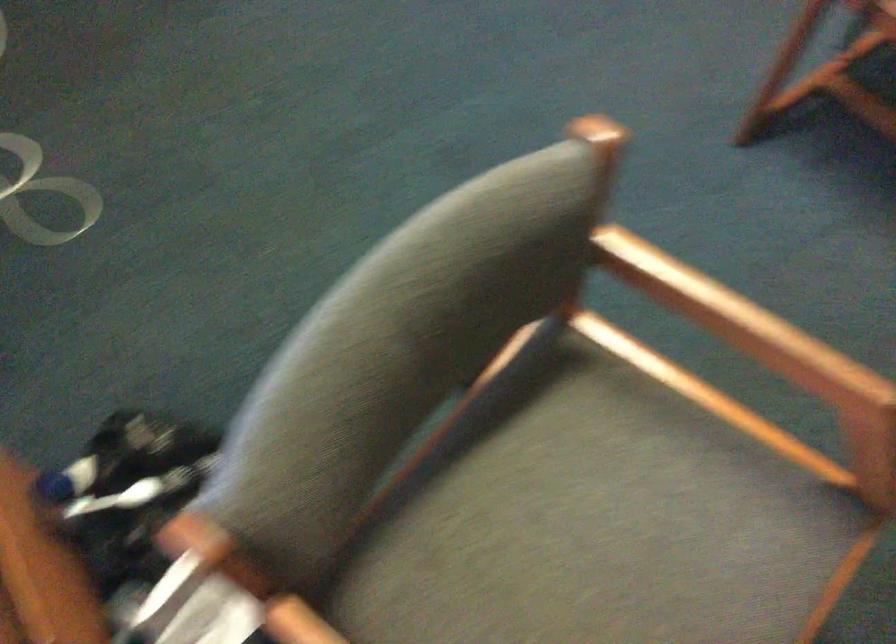
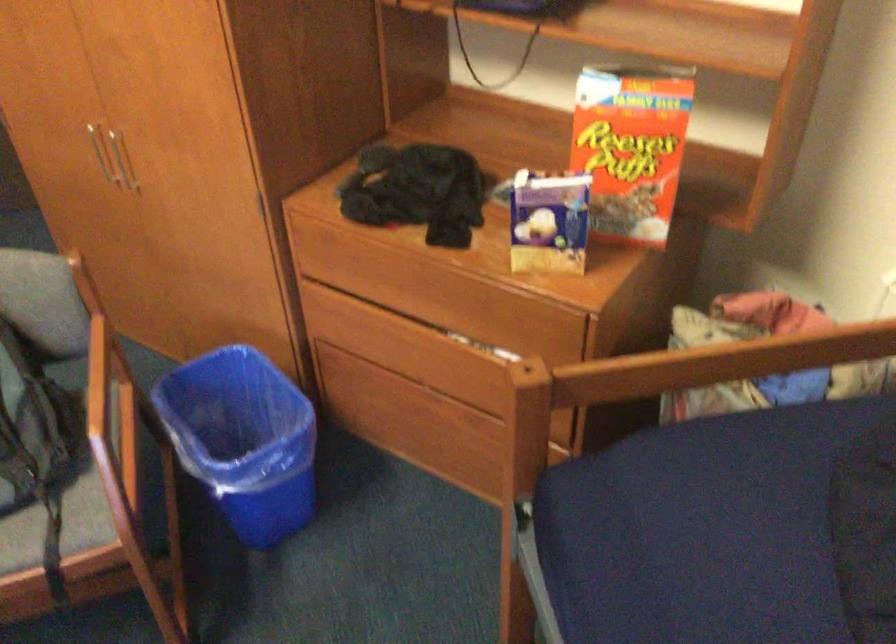
Question: How did the camera likely rotate?

Choices:
 (A) Left
 (B) Right
 (C) Up
 (D) Down

Answer: (B)